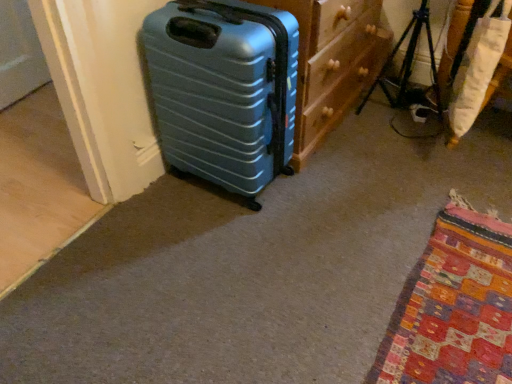
The height and width of the screenshot is (384, 512). What do you see at coordinates (332, 62) in the screenshot? I see `wooden dresser at center` at bounding box center [332, 62].

Where is `wooden dresser at center`? This screenshot has width=512, height=384. wooden dresser at center is located at coordinates (332, 62).

Is wooden dresser at center in contact with white fabric cushion at right?

No, wooden dresser at center is not beside white fabric cushion at right.

Is wooden dresser at center to the left or to the right of white fabric cushion at right in the image?

wooden dresser at center is to the left of white fabric cushion at right.

Considering the sizes of objects wooden dresser at center and white fabric cushion at right in the image provided, who is bigger, wooden dresser at center or white fabric cushion at right?

With larger size is wooden dresser at center.

Between point (269, 1) and point (487, 68), which one is positioned behind?

The point (487, 68) is farther from the camera.

Is white fabric cushion at right not inside metallic tripod at center right?

white fabric cushion at right is positioned outside metallic tripod at center right.

Is white fabric cushion at right bigger or smaller than metallic tripod at center right?

white fabric cushion at right is smaller than metallic tripod at center right.

Is white fabric cushion at right to the left of metallic tripod at center right from the viewer's perspective?

Incorrect, white fabric cushion at right is not on the left side of metallic tripod at center right.

Is metallic tripod at center right at the back of white fabric cushion at right?

No, white fabric cushion at right's orientation is not away from metallic tripod at center right.

Consider the image. From the image's perspective, who appears lower, white fabric cushion at right or wooden dresser at center?

white fabric cushion at right, from the image's perspective.

Is white fabric cushion at right positioned with its back to wooden dresser at center?

No, wooden dresser at center is not at the back of white fabric cushion at right.

Can you confirm if white fabric cushion at right is smaller than wooden dresser at center?

Yes.

Between white fabric cushion at right and wooden dresser at center, which one has more height?

Standing taller between the two is wooden dresser at center.

Does white fabric cushion at right appear on the right side of teal plastic suitcase at left?

Indeed, white fabric cushion at right is positioned on the right side of teal plastic suitcase at left.

Is white fabric cushion at right behind teal plastic suitcase at left?

Yes, the depth of white fabric cushion at right is greater than that of teal plastic suitcase at left.

Which of these two, white fabric cushion at right or teal plastic suitcase at left, is thinner?

Thinner between the two is white fabric cushion at right.

From the image's perspective, is white fabric cushion at right on top of teal plastic suitcase at left?

Yes, from the image's perspective, white fabric cushion at right is over teal plastic suitcase at left.

From the image's perspective, would you say wooden dresser at center is positioned over metallic tripod at center right?

Yes.

Is wooden dresser at center positioned far away from metallic tripod at center right?

No, wooden dresser at center is in close proximity to metallic tripod at center right.

Consider the image. Does wooden dresser at center turn towards metallic tripod at center right?

Yes, wooden dresser at center is facing metallic tripod at center right.

From a real-world perspective, between wooden dresser at center and metallic tripod at center right, who is vertically lower?

metallic tripod at center right.

Can you tell me how much teal plastic suitcase at left and white fabric cushion at right differ in facing direction?

teal plastic suitcase at left and white fabric cushion at right are facing 164 degrees away from each other.

Between teal plastic suitcase at left and white fabric cushion at right, which one has more height?

teal plastic suitcase at left.

In terms of size, does teal plastic suitcase at left appear bigger or smaller than white fabric cushion at right?

In the image, teal plastic suitcase at left appears to be larger than white fabric cushion at right.

From the image's perspective, relative to white fabric cushion at right, is teal plastic suitcase at left above or below?

teal plastic suitcase at left is situated lower than white fabric cushion at right in the image.

From a real-world perspective, is teal plastic suitcase at left above or below metallic tripod at center right?

In terms of real-world spatial position, teal plastic suitcase at left is above metallic tripod at center right.

In order to click on tripod directly beneath the teal plastic suitcase at left (from a real-world perspective) in this screenshot , I will do `click(409, 65)`.

Is teal plastic suitcase at left facing away from metallic tripod at center right?

teal plastic suitcase at left is not turned away from metallic tripod at center right.

Who is smaller, teal plastic suitcase at left or metallic tripod at center right?

metallic tripod at center right is smaller.

Image resolution: width=512 pixels, height=384 pixels. I want to click on furniture below the wooden dresser at center (from the image's perspective), so click(x=478, y=71).

Where is `tripod above the white fabric cushion at right (from the image's perspective)`? tripod above the white fabric cushion at right (from the image's perspective) is located at coordinates (409, 65).

When comparing their distances from wooden dresser at center, does white fabric cushion at right or teal plastic suitcase at left seem further?

The object further to wooden dresser at center is white fabric cushion at right.

Looking at the image, which one is located closer to metallic tripod at center right, wooden dresser at center or white fabric cushion at right?

Based on the image, wooden dresser at center appears to be nearer to metallic tripod at center right.

When comparing their distances from white fabric cushion at right, does wooden dresser at center or metallic tripod at center right seem closer?

metallic tripod at center right is closer to white fabric cushion at right.

Considering their positions, is wooden dresser at center positioned further to white fabric cushion at right than teal plastic suitcase at left?

The object further to white fabric cushion at right is teal plastic suitcase at left.

Considering their positions, is metallic tripod at center right positioned further to teal plastic suitcase at left than white fabric cushion at right?

Among the two, metallic tripod at center right is located further to teal plastic suitcase at left.

Based on their spatial positions, is wooden dresser at center or white fabric cushion at right further from teal plastic suitcase at left?

white fabric cushion at right.

From the image, which object appears to be farther from metallic tripod at center right, white fabric cushion at right or wooden dresser at center?

The object further to metallic tripod at center right is white fabric cushion at right.

Looking at the image, which one is located closer to wooden dresser at center, teal plastic suitcase at left or white fabric cushion at right?

teal plastic suitcase at left is closer to wooden dresser at center.

Locate an element on the screen. The width and height of the screenshot is (512, 384). dresser located between teal plastic suitcase at left and white fabric cushion at right in the left-right direction is located at coordinates (x=332, y=62).

This screenshot has width=512, height=384. I want to click on tripod between wooden dresser at center and white fabric cushion at right in the horizontal direction, so click(409, 65).

You are a GUI agent. You are given a task and a screenshot of the screen. Output one action in this format:
    pyautogui.click(x=<x>, y=<y>)
    Task: Click on the dresser situated between teal plastic suitcase at left and metallic tripod at center right from left to right
    This screenshot has height=384, width=512.
    Given the screenshot: What is the action you would take?
    pyautogui.click(x=332, y=62)

Where is `tripod between teal plastic suitcase at left and white fabric cushion at right`? The height and width of the screenshot is (384, 512). tripod between teal plastic suitcase at left and white fabric cushion at right is located at coordinates (409, 65).